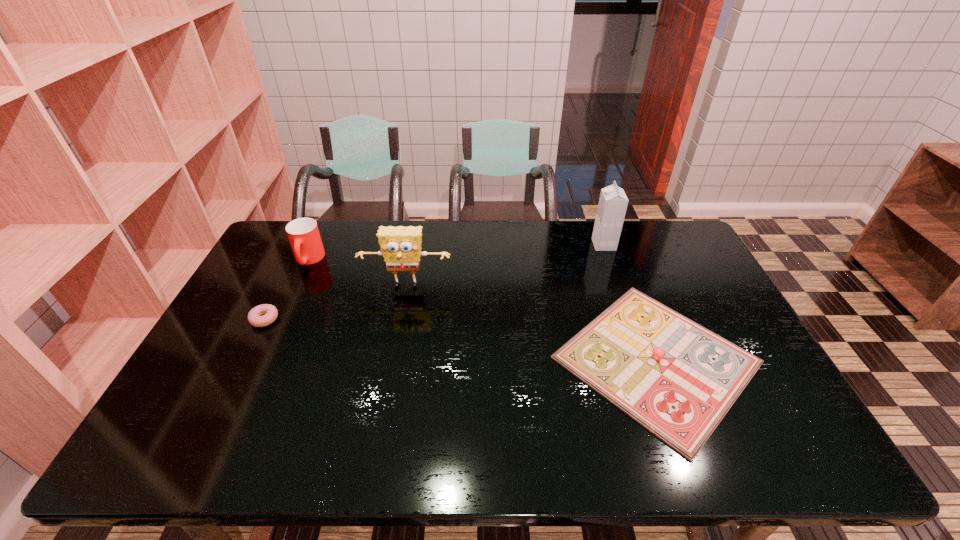
At what (x,y) coordinates should I click in order to perform the action: click on free space between the cup and the shortest object. Please return your answer as a coordinate pair (x, y). Looking at the image, I should click on (287, 289).

You are a GUI agent. You are given a task and a screenshot of the screen. Output one action in this format:
    pyautogui.click(x=<x>, y=<y>)
    Task: Click on the free spot between the third shortest object and the carton
    
    Given the screenshot: What is the action you would take?
    pyautogui.click(x=456, y=252)

What are the coordinates of `vacant space that's between the cup and the doughnut` in the screenshot? It's located at (287, 289).

Identify the location of unoccupied position between the doughnut and the gameboard. The width and height of the screenshot is (960, 540). (461, 340).

Select which object is the second closest to the third shortest object. Please provide its 2D coordinates. Your answer should be formatted as a tuple, i.e. [(x, y)], where the tuple contains the x and y coordinates of a point satisfying the conditions above.

[(269, 312)]

In order to click on the second closest object to the shortest object in this screenshot , I will do point(400,246).

Identify the location of vacant region that satisfies the following two spatial constraints: 1. on the front label of the carton; 2. on the back side of the second shortest object. The height and width of the screenshot is (540, 960). (644, 360).

Locate an element on the screen. Image resolution: width=960 pixels, height=540 pixels. vacant space that satisfies the following two spatial constraints: 1. on the front label of the second shortest object; 2. on the left side of the carton is located at coordinates (644, 360).

Find the location of a particular element. The width and height of the screenshot is (960, 540). vacant region that satisfies the following two spatial constraints: 1. on the front label of the carton; 2. on the face of the sponge is located at coordinates (618, 287).

Where is `free space that satisfies the following two spatial constraints: 1. on the front label of the carton; 2. on the face of the third object from right to left`? The width and height of the screenshot is (960, 540). free space that satisfies the following two spatial constraints: 1. on the front label of the carton; 2. on the face of the third object from right to left is located at coordinates (618, 287).